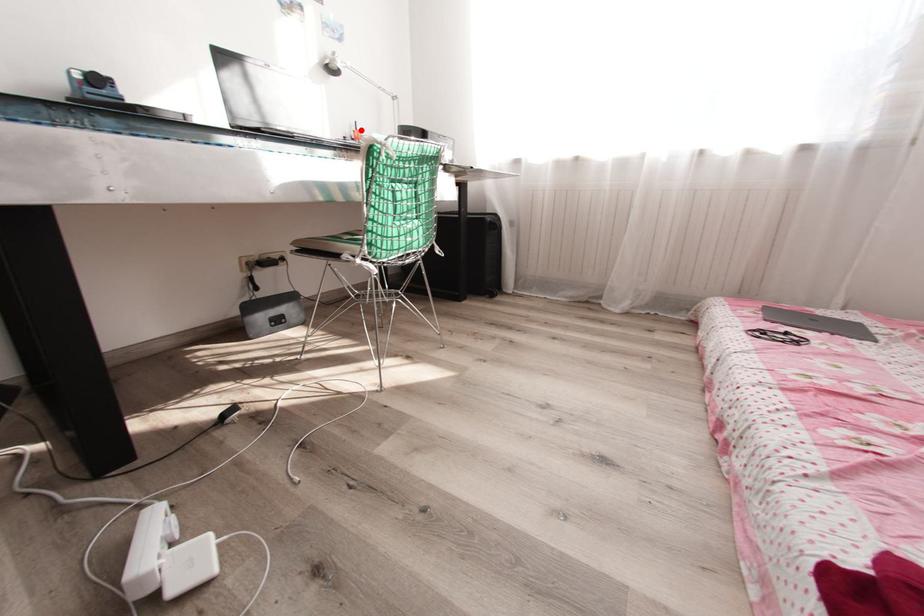
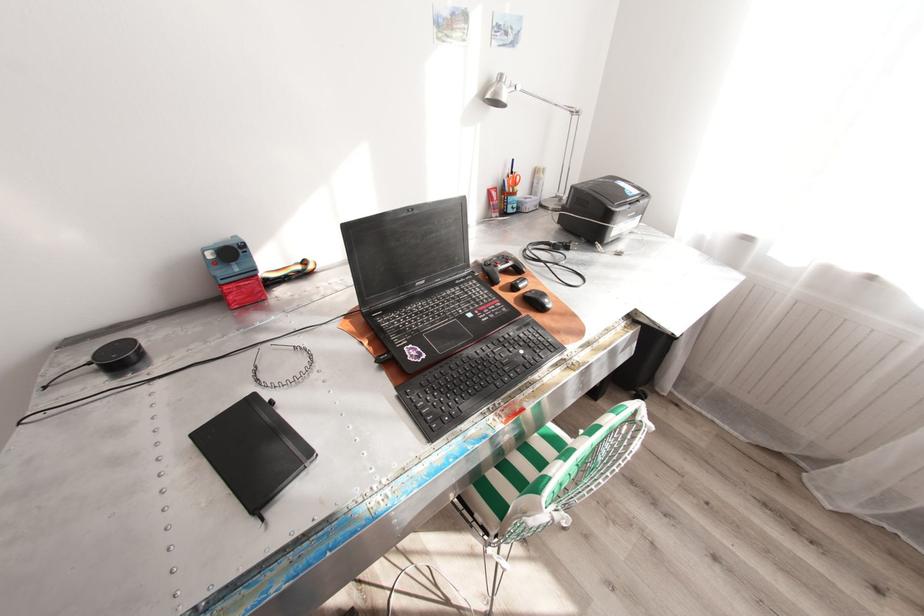
Question: A red point is marked in image1. In image2, is the corresponding 3D point closer to the camera or farther? Reply with the corresponding letter.

Choices:
 (A) The corresponding 3D point is closer.
 (B) The corresponding 3D point is farther.

Answer: (B)